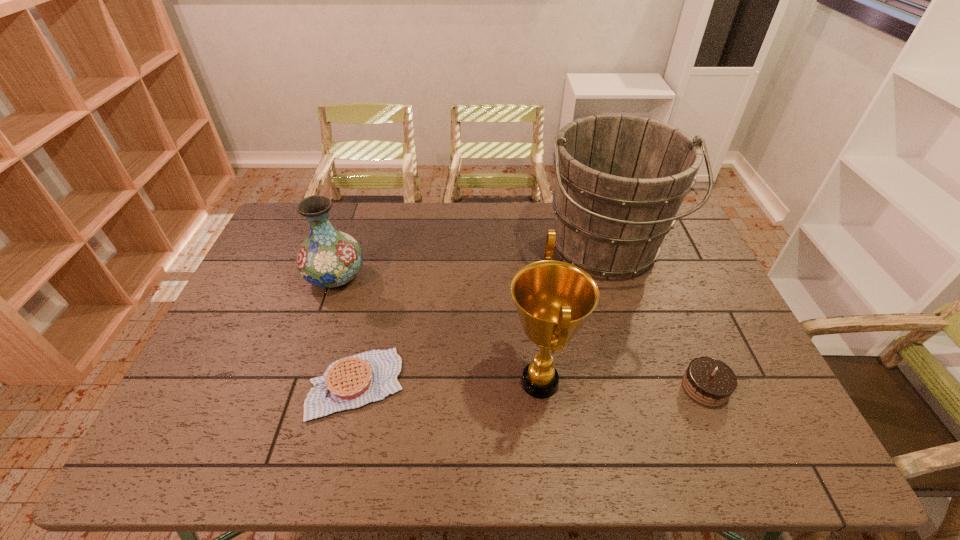
Identify the location of free space between the chocolate cake and the award. Image resolution: width=960 pixels, height=540 pixels. (622, 384).

The height and width of the screenshot is (540, 960). I want to click on vacant area that lies between the pie and the third shortest object, so click(x=347, y=330).

You are a GUI agent. You are given a task and a screenshot of the screen. Output one action in this format:
    pyautogui.click(x=<x>, y=<y>)
    Task: Click on the vacant region between the pie and the bucket
    
    Given the screenshot: What is the action you would take?
    pyautogui.click(x=480, y=316)

Locate an element on the screen. This screenshot has width=960, height=540. free space between the vase and the award is located at coordinates (438, 329).

Where is `free space between the chocolate cake and the award`? Image resolution: width=960 pixels, height=540 pixels. free space between the chocolate cake and the award is located at coordinates (622, 384).

The width and height of the screenshot is (960, 540). I want to click on free space between the pie and the award, so click(448, 383).

The image size is (960, 540). I want to click on the third closest object relative to the third shortest object, so click(x=620, y=180).

Locate an element on the screen. the closest object to the shortest object is located at coordinates (328, 258).

At what (x,y) coordinates should I click in order to perform the action: click on free point that satisfies the following two spatial constraints: 1. on the front view with handles of the fourth tallest object; 2. on the right side of the award. Please return your answer as a coordinate pair (x, y). Looking at the image, I should click on (540, 387).

The image size is (960, 540). I want to click on vacant space that satisfies the following two spatial constraints: 1. on the front view with handles of the award; 2. on the back side of the chocolate cake, so click(x=540, y=387).